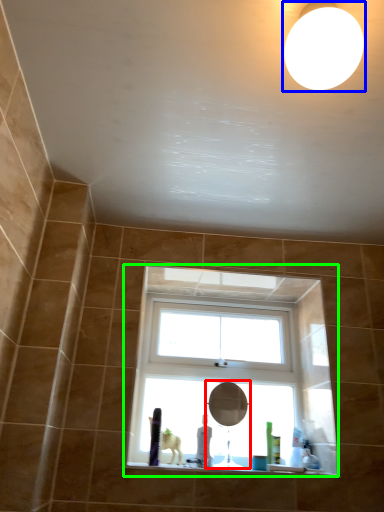
Question: Based on their relative distances, which object is farther from mirror (highlighted by a red box)? Choose from lighting (highlighted by a blue box) and window (highlighted by a green box).

Choices:
 (A) lighting
 (B) window

Answer: (A)